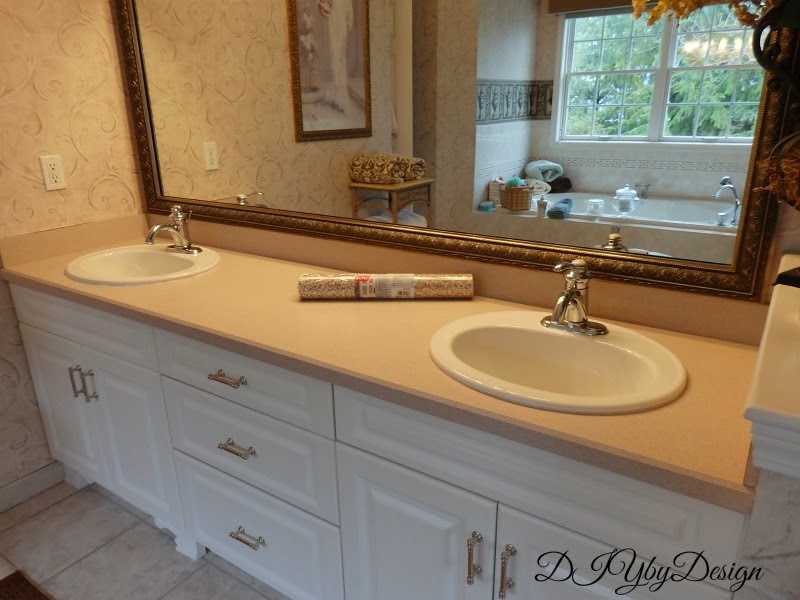
Where is `tile`? The width and height of the screenshot is (800, 600). tile is located at coordinates (518, 104), (514, 63).